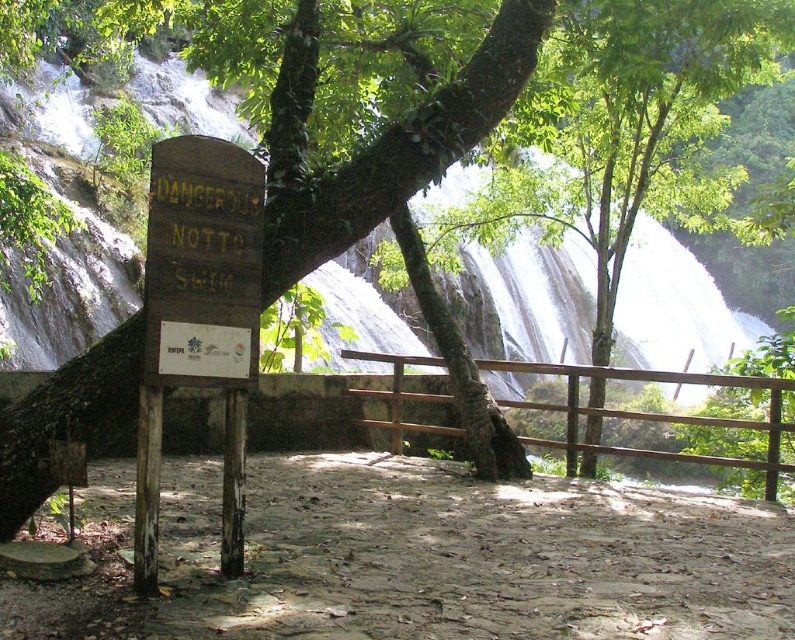
Question: Which of the following is the closest to the observer?

Choices:
 (A) (684, 396)
 (B) (196, 308)

Answer: (B)

Question: Which point is closer to the camera?

Choices:
 (A) wooden sign at center
 (B) white frothy water at center

Answer: (A)

Question: Is white frothy water at center closer to camera compared to wooden sign at center?

Choices:
 (A) yes
 (B) no

Answer: (B)

Question: Which object is closer to the camera taking this photo?

Choices:
 (A) wooden sign at center
 (B) white frothy water at center

Answer: (A)

Question: Is white frothy water at center to the left of wooden sign at center from the viewer's perspective?

Choices:
 (A) yes
 (B) no

Answer: (B)

Question: Can you confirm if white frothy water at center is positioned to the left of wooden sign at center?

Choices:
 (A) yes
 (B) no

Answer: (B)